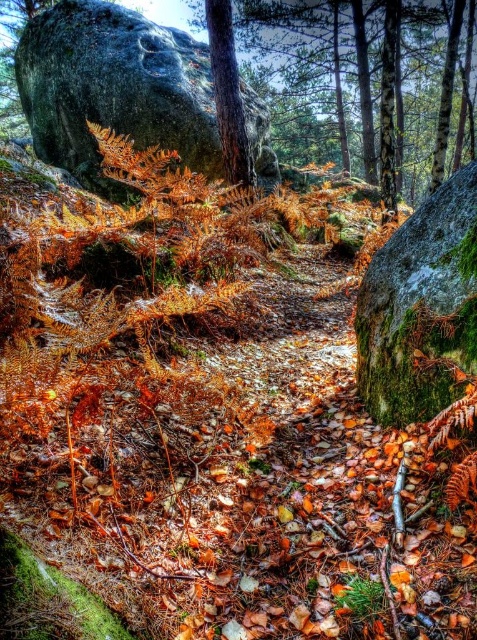
Is point (79, 116) positioned before point (428, 316)?

No, (79, 116) is further to viewer.

Can you confirm if green mossy rock at upper left is thinner than green mossy boulder at right?

In fact, green mossy rock at upper left might be wider than green mossy boulder at right.

What do you see at coordinates (114, 88) in the screenshot? The image size is (477, 640). I see `green mossy rock at upper left` at bounding box center [114, 88].

Identify the location of green mossy rock at upper left. (114, 88).